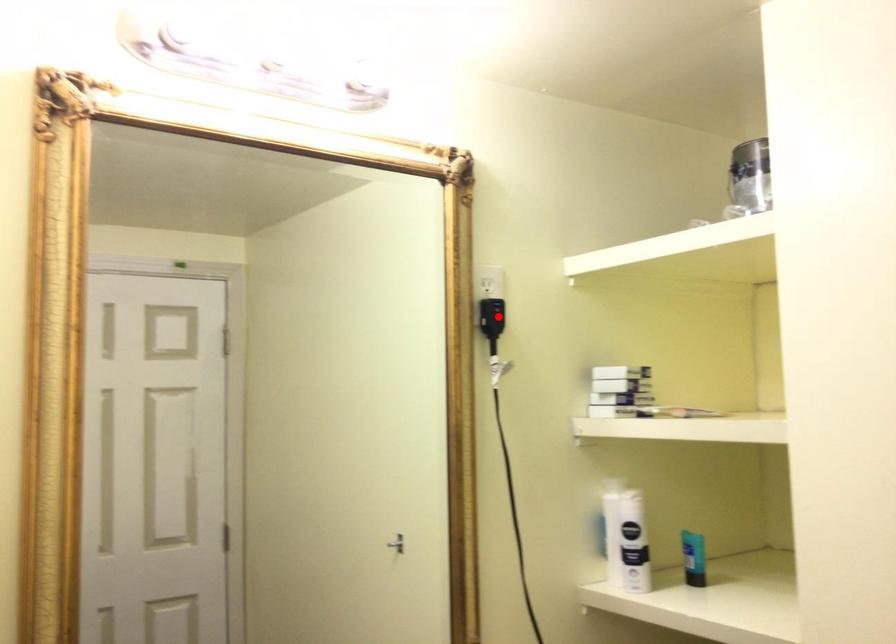
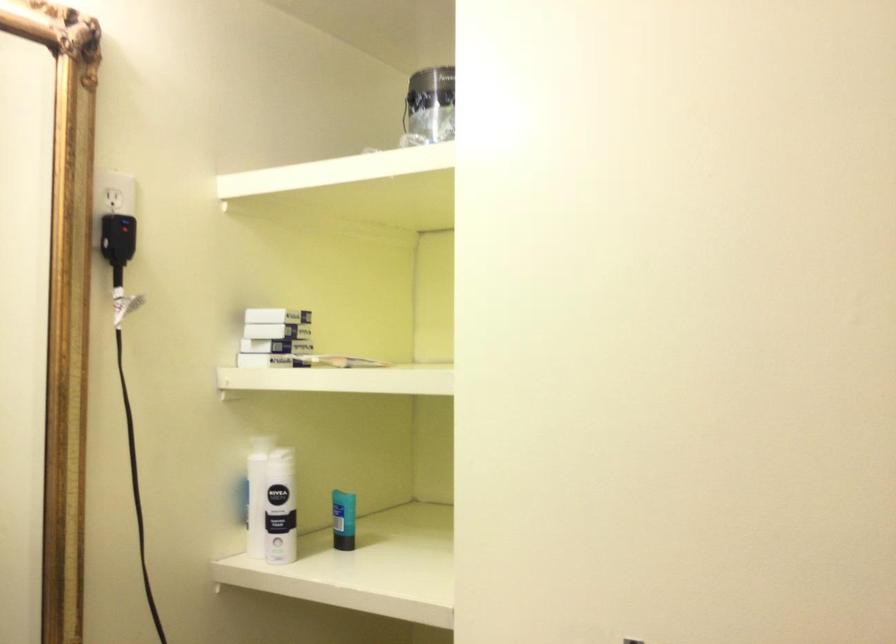
Question: I am providing you with two images of the same scene from different viewpoints. Image1 has a red point marked. In image2, the corresponding 3D location appears at what relative position? Reply with the corresponding letter.

Choices:
 (A) Closer
 (B) Farther

Answer: (A)